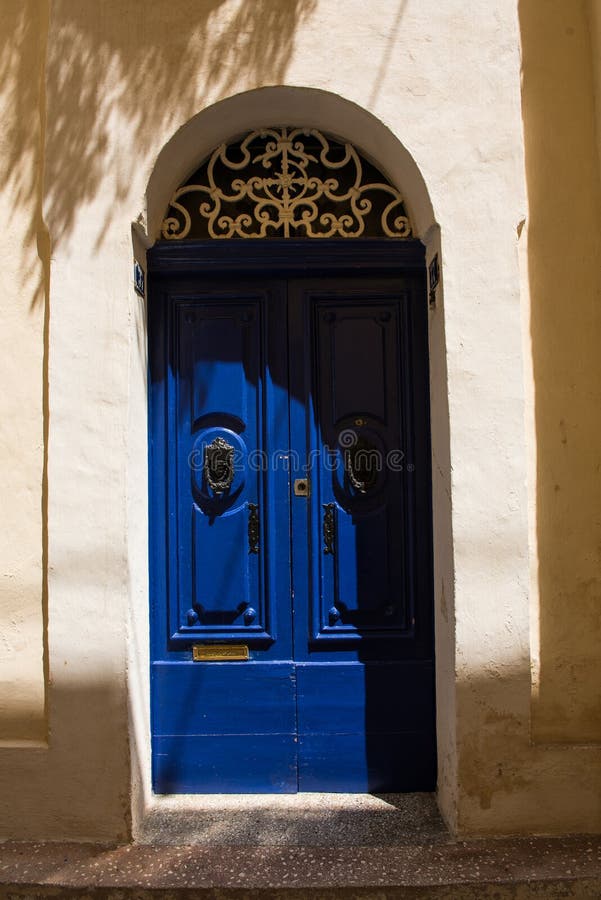
At what (x,y) coordinates should I click in order to perform the action: click on shade on the door. Please return your answer as a coordinate pair (x, y). The image size is (601, 900). Looking at the image, I should click on (383, 574), (361, 402), (297, 346), (231, 338).